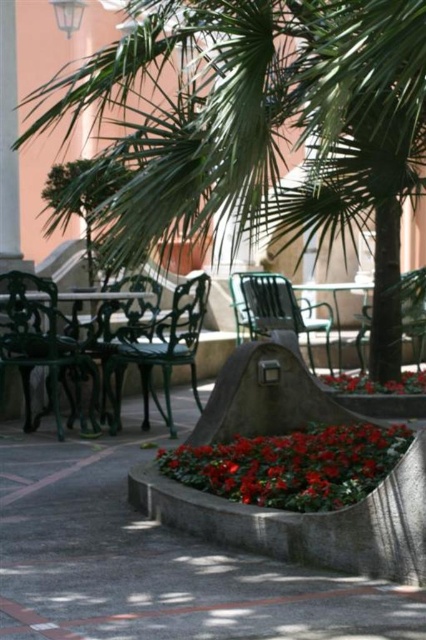
In the scene shown: Is concrete at center shorter than metallic green park bench at center?

Correct, concrete at center is not as tall as metallic green park bench at center.

Is concrete at center in front of metallic green park bench at center?

Yes, concrete at center is closer to the viewer.

Measure the distance between point (250, 618) and camera.

Point (250, 618) is 2.92 meters away from camera.

You are a GUI agent. You are given a task and a screenshot of the screen. Output one action in this format:
    pyautogui.click(x=<x>, y=<y>)
    Task: Click on the concrete at center
    This screenshot has width=426, height=640.
    Given the screenshot: What is the action you would take?
    pyautogui.click(x=155, y=561)

Can you confirm if green leafy palm tree at center is wider than glossy red flowers at center?

Indeed, green leafy palm tree at center has a greater width compared to glossy red flowers at center.

The height and width of the screenshot is (640, 426). I want to click on green leafy palm tree at center, so pos(261,128).

Is green leafy palm tree at center positioned behind concrete at center?

That is True.

How much distance is there between green leafy palm tree at center and concrete at center?

green leafy palm tree at center is 8.12 feet from concrete at center.

Is point (308, 48) positioned in front of point (365, 624)?

No, (308, 48) is behind (365, 624).

This screenshot has width=426, height=640. What are the coordinates of `green leafy palm tree at center` in the screenshot? It's located at (261, 128).